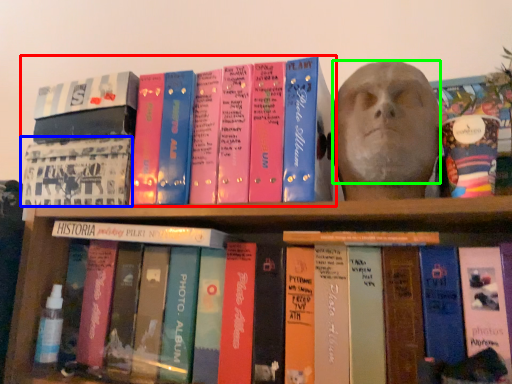
Question: Which object is the closest to the book (highlighted by a red box)? Choose among these: book cover (highlighted by a blue box) or human face (highlighted by a green box).

Choices:
 (A) book cover
 (B) human face

Answer: (A)